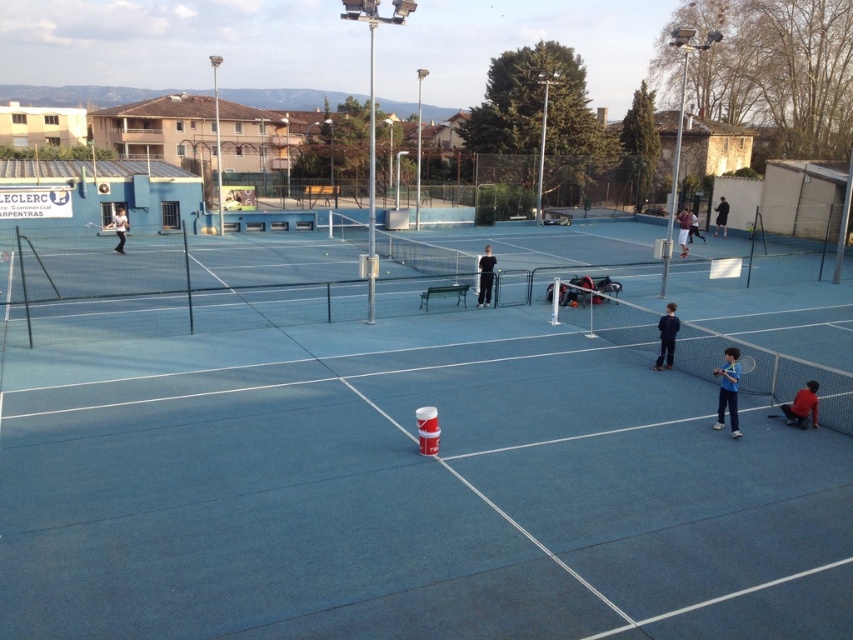
You are standing at the baseline of the tennis court and want to throw a tennis ball to the black fabric person at center. What is the minimum distance you need to throw the ball?

The minimum distance you need to throw the ball is 19.34 meters to reach the black fabric person at center.

You are standing on the tennis court and see the black fabric person at center and the dark blue fabric tennis racket at right. Which object is nearer to you?

The black fabric person at center is closer to the viewer than the dark blue fabric tennis racket at right.